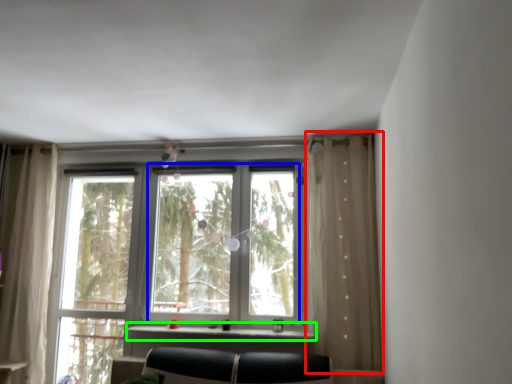
Question: Which is nearer to the curtain (highlighted by a red box)? bay window (highlighted by a blue box) or window sill (highlighted by a green box).

Choices:
 (A) bay window
 (B) window sill

Answer: (A)